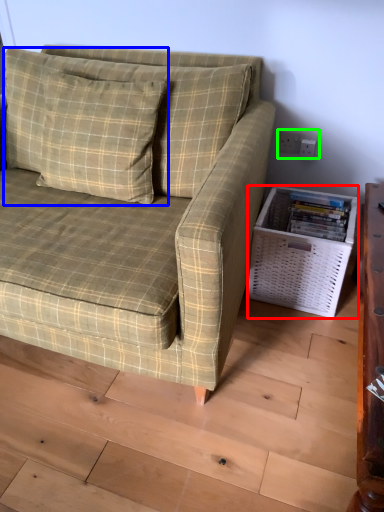
Question: Considering the real-world distances, which object is closest to basket (highlighted by a red box)? pillow (highlighted by a blue box) or electric outlet (highlighted by a green box).

Choices:
 (A) pillow
 (B) electric outlet

Answer: (B)